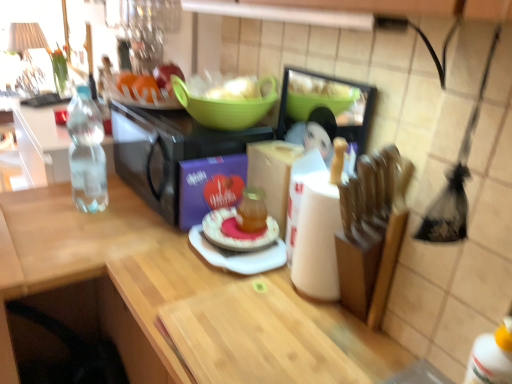
Question: From their relative heights in the image, would you say green plastic bowl at upper center is taller or shorter than pink glossy plate at center?

Choices:
 (A) tall
 (B) short

Answer: (A)

Question: From the image's perspective, relative to pink glossy plate at center, is green plastic bowl at upper center above or below?

Choices:
 (A) above
 (B) below

Answer: (A)

Question: Considering the real-world distances, which object is farthest from the pink glossy plate at center?

Choices:
 (A) green plastic bowl at upper center
 (B) clear plastic bottle at left
 (C) wooden cutting board at center
 (D) black matte microwave at center, which is the second appliance in right-to-left order
 (E) wooden cutting board at center, acting as the second appliance starting from the left

Answer: (B)

Question: Estimate the real-world distances between objects in this image. Which object is farther from the pink glossy plate at center?

Choices:
 (A) green plastic bowl at upper center
 (B) clear plastic bottle at left
 (C) wooden cutting board at center
 (D) black matte microwave at center, which is counted as the first appliance, starting from the left
 (E) wooden cutting board at center, acting as the second appliance starting from the left

Answer: (B)